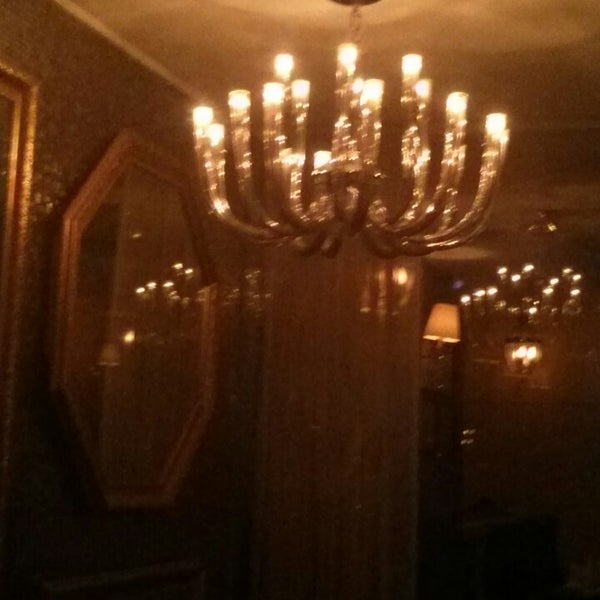
Find the location of a particular element. The image size is (600, 600). chandelier in top center of image is located at coordinates (346, 150).